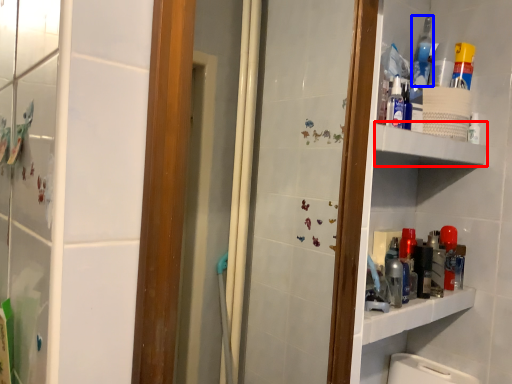
Question: Which object appears farthest to the camera in this image, shelve (highlighted by a red box) or mouthwash (highlighted by a blue box)?

Choices:
 (A) shelve
 (B) mouthwash

Answer: (B)